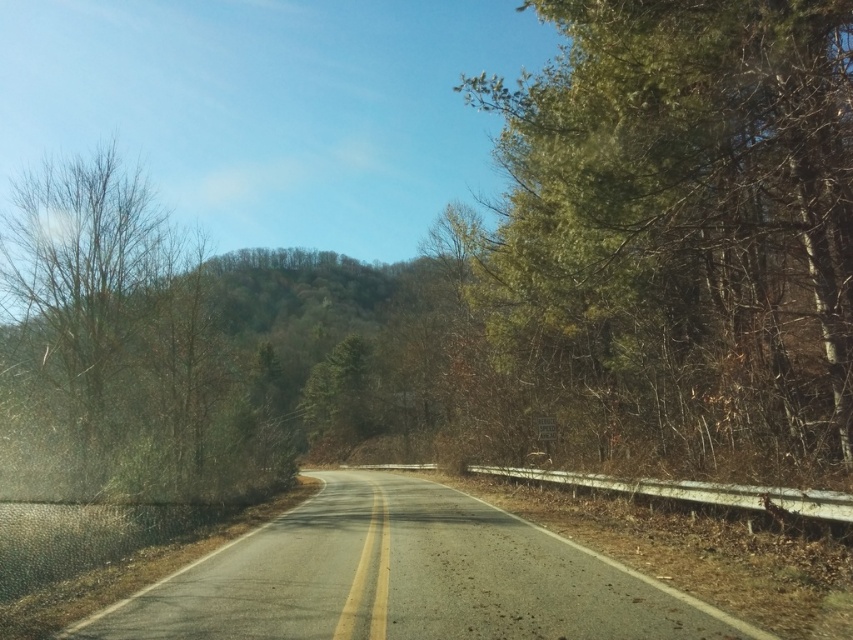
Based on the photo, you are a bird flying over the rural road scene. You want to land on a tree with leaves to rest. Which tree should you choose between the green leafy tree at right and the bare branches at left?

The green leafy tree at right has leaves, so you should choose the green leafy tree at right to land on.

You are driving a car and see the green leafy tree at right and the bare branches at left from the driver seat. Which object is closer to the road edge?

The green leafy tree at right is positioned on the right side of bare branches at left, so the green leafy tree at right is closer to the road edge.

You are driving a car and see the green leafy tree at right and the bare branches at left from your perspective. Which tree is closer to you?

The green leafy tree at right is closer to you because it is in front of the bare branches at left.